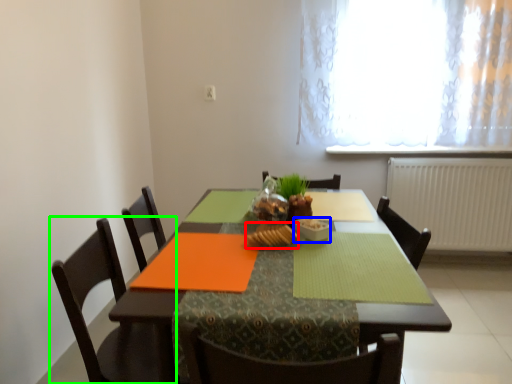
Question: Which is nearer to the food (highlighted by a red box)? tableware (highlighted by a blue box) or chair (highlighted by a green box).

Choices:
 (A) tableware
 (B) chair

Answer: (A)